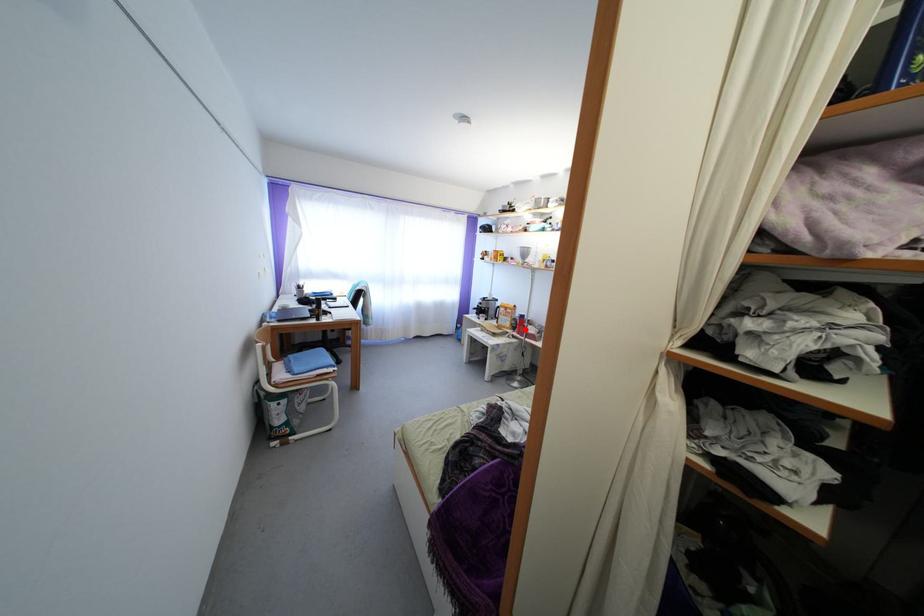
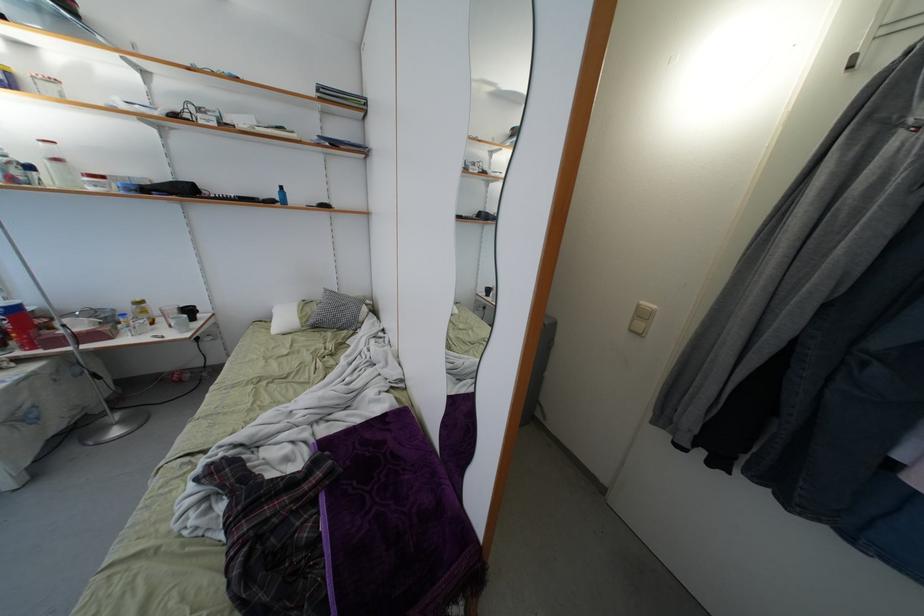
Find the pixel in the second image that matches the highlighted location in the first image.

(22, 333)